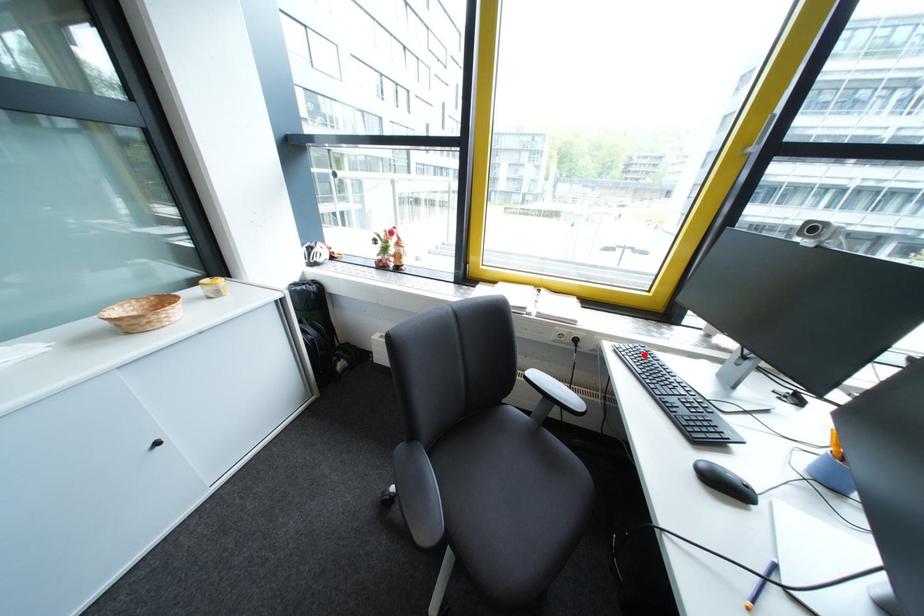
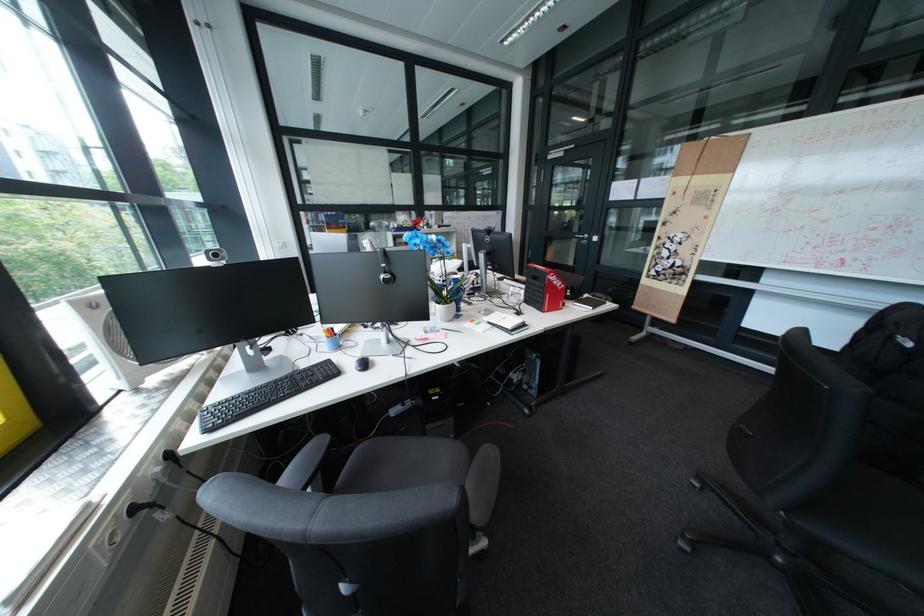
Question: I am providing you with two images of the same scene from different viewpoints. A red point is marked on the first image. Can you still see the location of the red point in image 2?

Choices:
 (A) Yes
 (B) No

Answer: (A)